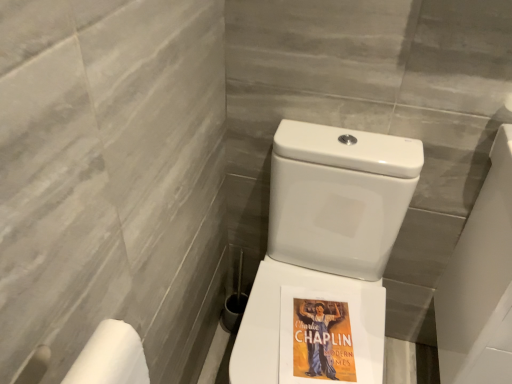
Question: From the image's perspective, is white glossy porcelain at right on white glossy toilet at center?

Choices:
 (A) no
 (B) yes

Answer: (B)

Question: From a real-world perspective, is white glossy porcelain at right beneath white glossy toilet at center?

Choices:
 (A) yes
 (B) no

Answer: (B)

Question: Is white glossy porcelain at right turned away from white glossy toilet at center?

Choices:
 (A) yes
 (B) no

Answer: (B)

Question: Is white glossy porcelain at right at the right side of white glossy toilet at center?

Choices:
 (A) yes
 (B) no

Answer: (A)

Question: Is white glossy toilet at center inside white glossy porcelain at right?

Choices:
 (A) no
 (B) yes

Answer: (A)

Question: Is white glossy porcelain at right wider than white glossy toilet at center?

Choices:
 (A) yes
 (B) no

Answer: (B)

Question: Can you confirm if white glossy toilet at center is taller than white matte toilet paper at lower left?

Choices:
 (A) yes
 (B) no

Answer: (A)

Question: From a real-world perspective, is white glossy toilet at center physically below white matte toilet paper at lower left?

Choices:
 (A) yes
 (B) no

Answer: (A)

Question: Can you confirm if white glossy toilet at center is wider than white matte toilet paper at lower left?

Choices:
 (A) yes
 (B) no

Answer: (A)

Question: Is white glossy toilet at center looking in the opposite direction of white matte toilet paper at lower left?

Choices:
 (A) no
 (B) yes

Answer: (A)

Question: From the image's perspective, is white glossy toilet at center located beneath white matte toilet paper at lower left?

Choices:
 (A) no
 (B) yes

Answer: (B)

Question: Can you confirm if white glossy toilet at center is positioned to the left of white matte toilet paper at lower left?

Choices:
 (A) yes
 (B) no

Answer: (B)

Question: Considering the relative sizes of white glossy porcelain at right and white matte toilet paper at lower left in the image provided, is white glossy porcelain at right bigger than white matte toilet paper at lower left?

Choices:
 (A) no
 (B) yes

Answer: (B)